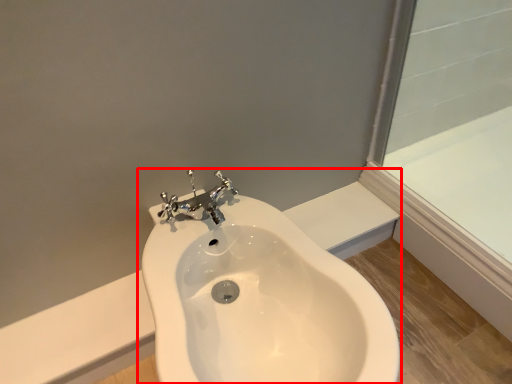
Question: From the image's perspective, where is sink (annotated by the red box) located relative to bath?

Choices:
 (A) above
 (B) below

Answer: (B)